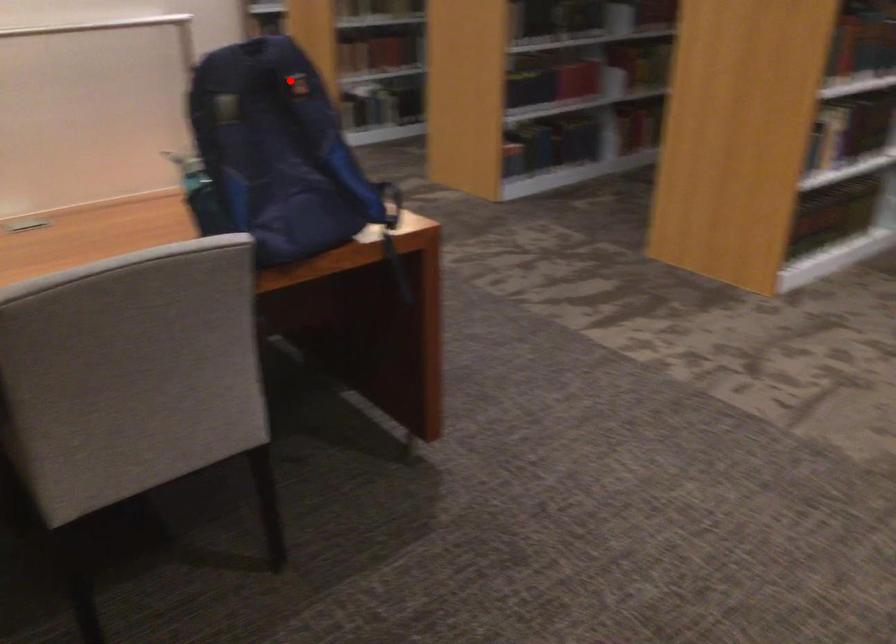
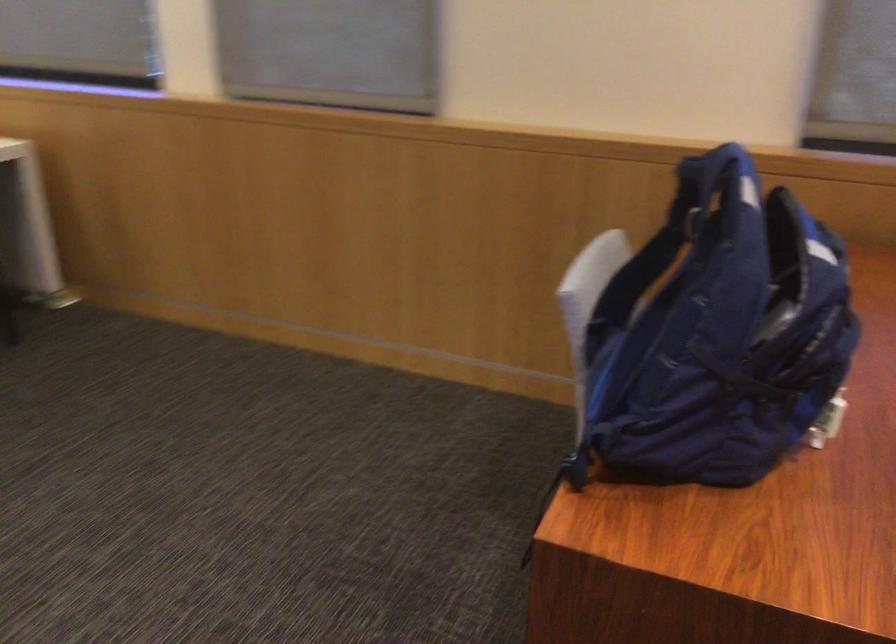
Question: I am providing you with two images of the same scene from different viewpoints. In image1, a red point is highlighted. Considering the same 3D point in image2, which of the following is correct?

Choices:
 (A) It is closer
 (B) It is farther

Answer: (A)